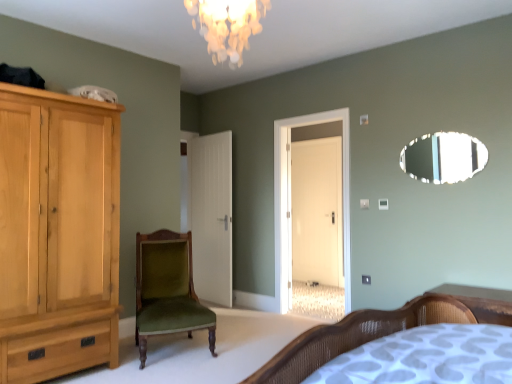
Image resolution: width=512 pixels, height=384 pixels. I want to click on free spot above oval glass mirror at upper right (from a real-world perspective), so click(445, 130).